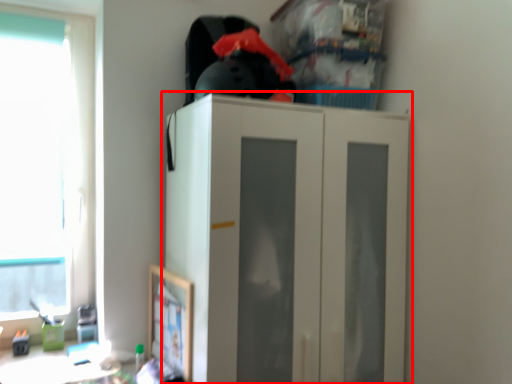
Question: From the image's perspective, where is cupboard (annotated by the red box) located in relation to window in the image?

Choices:
 (A) above
 (B) below

Answer: (B)